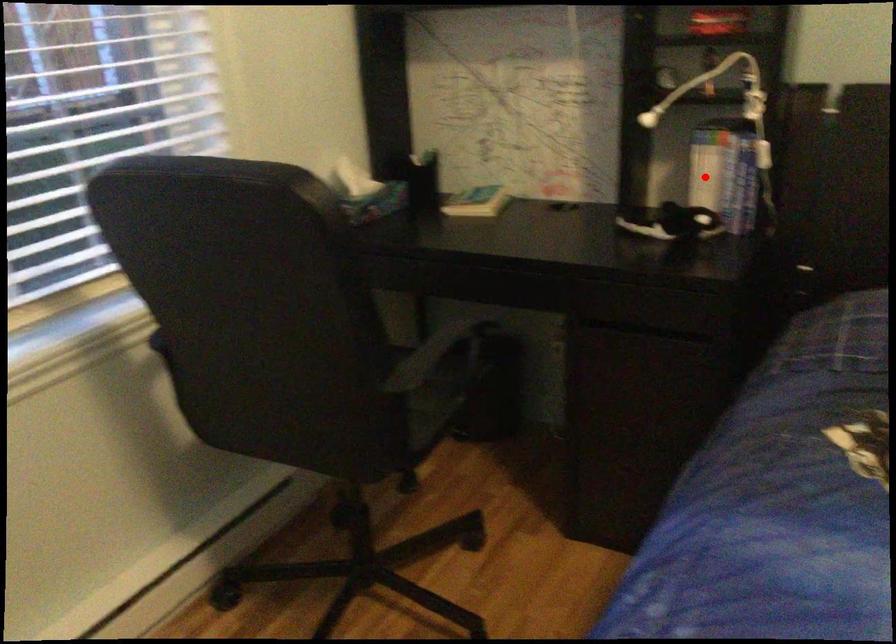
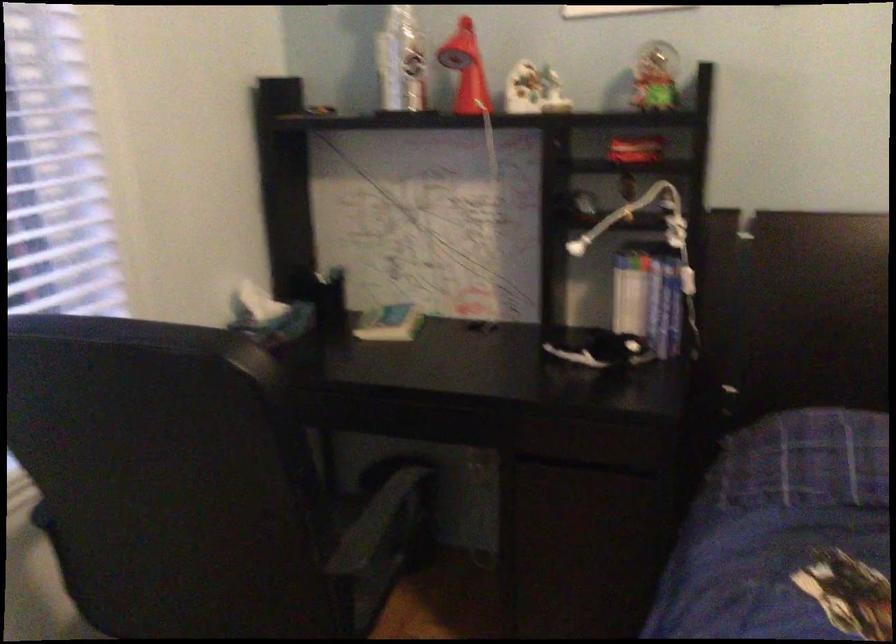
Locate, in the second image, the point that corresponds to the highlighted location in the first image.

(629, 301)